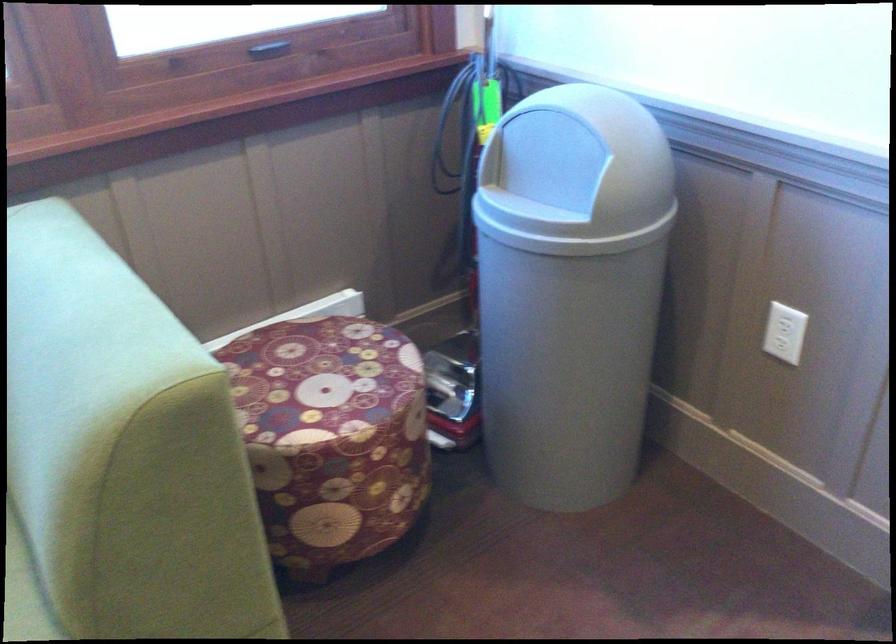
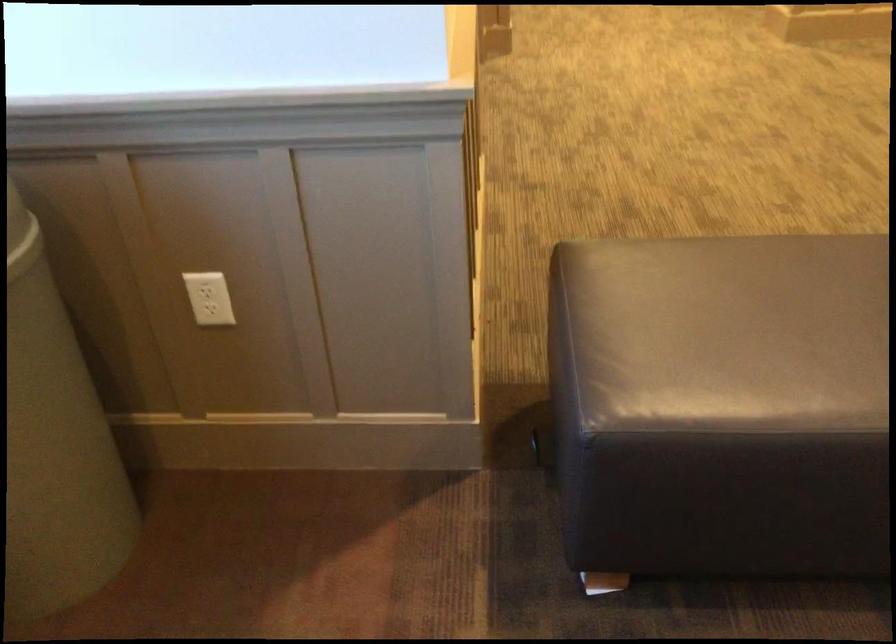
Question: The first image is from the beginning of the video and the second image is from the end. How did the camera likely rotate when shooting the video?

Choices:
 (A) Left
 (B) Right
 (C) Up
 (D) Down

Answer: (B)